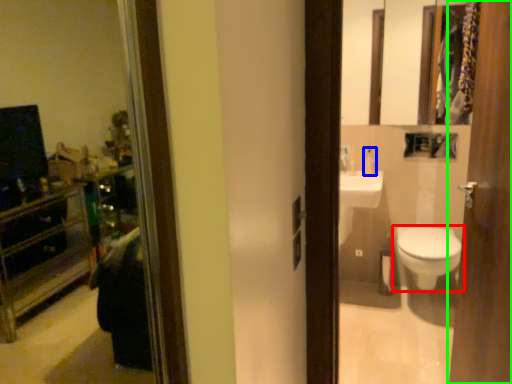
Question: Considering the real-world distances, which object is farthest from toilet (highlighted by a red box)? toiletry (highlighted by a blue box) or door (highlighted by a green box)?

Choices:
 (A) toiletry
 (B) door

Answer: (B)